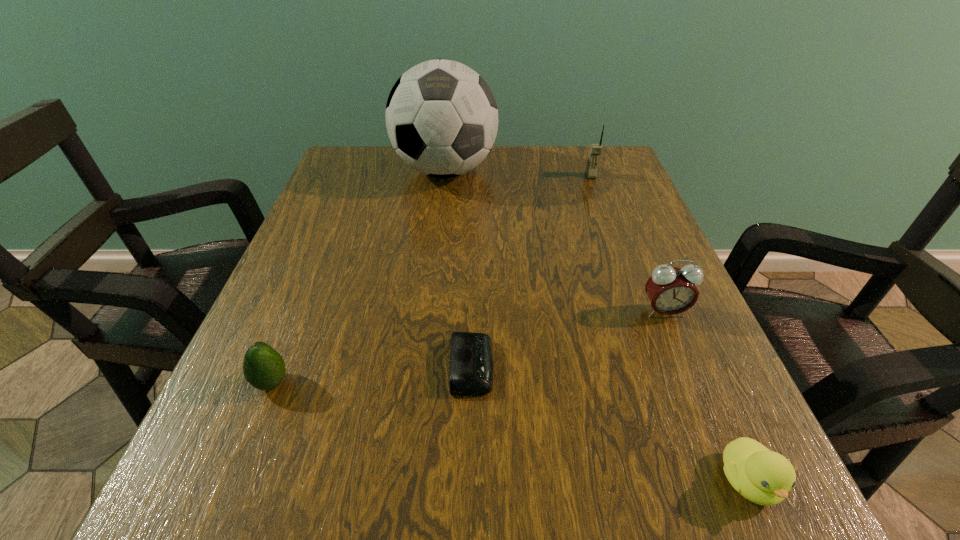
The image size is (960, 540). In order to click on vacant space at the far right corner of the desktop in this screenshot , I will do `click(616, 146)`.

The height and width of the screenshot is (540, 960). I want to click on unoccupied position between the tallest object and the left alarm clock, so 459,268.

Identify the location of vacant space in between the tallest object and the nearest object. The height and width of the screenshot is (540, 960). (597, 326).

Where is `empty space that is in between the tallest object and the right alarm clock`? empty space that is in between the tallest object and the right alarm clock is located at coordinates (555, 241).

This screenshot has width=960, height=540. I want to click on free space between the cellular telephone and the taller alarm clock, so 627,244.

The image size is (960, 540). I want to click on free space that is in between the duckling and the leftmost object, so click(x=510, y=431).

Find the location of a particular element. The image size is (960, 540). unoccupied position between the soccer ball and the cellular telephone is located at coordinates (518, 173).

This screenshot has width=960, height=540. I want to click on free area in between the cellular telephone and the avocado, so click(431, 279).

The image size is (960, 540). Identify the location of free space between the shortest object and the tallest object. (459, 268).

This screenshot has height=540, width=960. What are the coordinates of `empty space that is in between the taller alarm clock and the cellular telephone` in the screenshot? It's located at (627, 244).